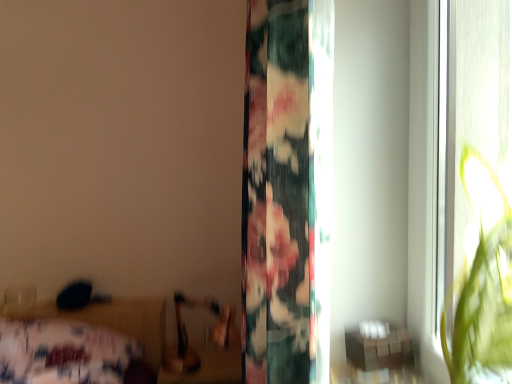
This screenshot has height=384, width=512. What do you see at coordinates (114, 320) in the screenshot? I see `floral fabric bed at lower left` at bounding box center [114, 320].

The height and width of the screenshot is (384, 512). Find the location of `floral fabric bed at lower left`. floral fabric bed at lower left is located at coordinates (114, 320).

Where is `wooden table at lower right`? wooden table at lower right is located at coordinates (379, 348).

What are the coordinates of `floral fabric curtain at center` in the screenshot? It's located at (276, 196).

Locate an element on the screen. The width and height of the screenshot is (512, 384). floral fabric bed at lower left is located at coordinates (114, 320).

At what (x,y) coordinates should I click in order to perform the action: click on curtain on the right of floral fabric bed at lower left. Please return your answer as a coordinate pair (x, y). Image resolution: width=512 pixels, height=384 pixels. Looking at the image, I should click on (276, 196).

From the picture: Is floral fabric curtain at center surrounding floral fabric bed at lower left?

Definitely not — floral fabric bed at lower left is not inside floral fabric curtain at center.

From a real-world perspective, is floral fabric curtain at center on top of floral fabric bed at lower left?

Yes, from a real-world perspective, floral fabric curtain at center is on top of floral fabric bed at lower left.

From the image's perspective, does floral fabric curtain at center appear higher than floral fabric bed at lower left?

Indeed, from the image's perspective, floral fabric curtain at center is shown above floral fabric bed at lower left.

Could you tell me if floral fabric bed at lower left is turned towards floral fabric curtain at center?

No, floral fabric bed at lower left is not oriented towards floral fabric curtain at center.

Can you confirm if floral fabric bed at lower left is shorter than floral fabric curtain at center?

Correct, floral fabric bed at lower left is not as tall as floral fabric curtain at center.

The width and height of the screenshot is (512, 384). I want to click on curtain in front of the floral fabric bed at lower left, so click(x=276, y=196).

Is floral fabric curtain at center completely or partially inside wooden table at lower right?

No, floral fabric curtain at center is not surrounded by wooden table at lower right.

From a real-world perspective, is wooden table at lower right physically located above or below floral fabric curtain at center?

wooden table at lower right is below floral fabric curtain at center.

Find the location of a particular element. This screenshot has height=384, width=512. table behind the floral fabric curtain at center is located at coordinates (379, 348).

Which of these two, wooden table at lower right or floral fabric curtain at center, is bigger?

floral fabric curtain at center.

Is floral fabric curtain at center wider than wooden table at lower right?

Yes, floral fabric curtain at center is wider than wooden table at lower right.

You are a GUI agent. You are given a task and a screenshot of the screen. Output one action in this format:
    pyautogui.click(x=<x>, y=<y>)
    Task: Click on the table to the right of floral fabric curtain at center
    This screenshot has width=512, height=384.
    Given the screenshot: What is the action you would take?
    pyautogui.click(x=379, y=348)

Based on the photo, can you confirm if floral fabric curtain at center is taller than wooden table at lower right?

Yes, floral fabric curtain at center is taller than wooden table at lower right.

Is floral fabric curtain at center looking in the opposite direction of wooden table at lower right?

Yes, floral fabric curtain at center's orientation is away from wooden table at lower right.

Is floral fabric bed at lower left closer to the viewer compared to wooden table at lower right?

No, floral fabric bed at lower left is further to the viewer.

Can you confirm if floral fabric bed at lower left is shorter than wooden table at lower right?

Incorrect, the height of floral fabric bed at lower left does not fall short of that of wooden table at lower right.

Is floral fabric bed at lower left to the right of wooden table at lower right from the viewer's perspective?

Incorrect, floral fabric bed at lower left is not on the right side of wooden table at lower right.

Is floral fabric bed at lower left facing towards wooden table at lower right?

Answer: No, floral fabric bed at lower left does not turn towards wooden table at lower right.

Measure the distance from wooden table at lower right to floral fabric bed at lower left.

4.01 feet.

From the image's perspective, is wooden table at lower right beneath floral fabric bed at lower left?

No.

Based on the photo, from a real-world perspective, which is physically above, wooden table at lower right or floral fabric bed at lower left?

wooden table at lower right is physically above.

Where is `bed behind the wooden table at lower right`? This screenshot has height=384, width=512. bed behind the wooden table at lower right is located at coordinates (114, 320).

Locate an element on the screen. curtain located above the floral fabric bed at lower left (from the image's perspective) is located at coordinates (276, 196).

Where is `curtain above the floral fabric bed at lower left (from a real-world perspective)`? The height and width of the screenshot is (384, 512). curtain above the floral fabric bed at lower left (from a real-world perspective) is located at coordinates (276, 196).

Which object lies further to the anchor point floral fabric bed at lower left, floral fabric curtain at center or wooden table at lower right?

wooden table at lower right.

Estimate the real-world distances between objects in this image. Which object is further from wooden table at lower right, floral fabric bed at lower left or floral fabric curtain at center?

Among the two, floral fabric bed at lower left is located further to wooden table at lower right.

Based on their spatial positions, is wooden table at lower right or floral fabric curtain at center further from floral fabric bed at lower left?

wooden table at lower right is positioned further to the anchor floral fabric bed at lower left.

From the image, which object appears to be nearer to floral fabric curtain at center, wooden table at lower right or floral fabric bed at lower left?

wooden table at lower right.

When comparing their distances from wooden table at lower right, does floral fabric curtain at center or floral fabric bed at lower left seem further?

The object further to wooden table at lower right is floral fabric bed at lower left.

Which object lies nearer to the anchor point floral fabric curtain at center, floral fabric bed at lower left or wooden table at lower right?

The object closer to floral fabric curtain at center is wooden table at lower right.

Identify the location of curtain situated between floral fabric bed at lower left and wooden table at lower right from left to right. (276, 196).